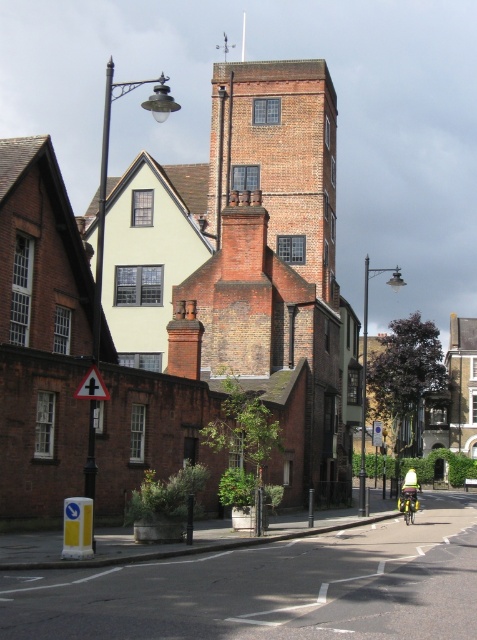
Is metallic triangular sign at center smaller than green fabric helmet at center?

Yes.

Which is behind, point (83, 385) or point (414, 499)?

Positioned behind is point (414, 499).

The width and height of the screenshot is (477, 640). Find the location of `metallic triangular sign at center`. metallic triangular sign at center is located at coordinates (92, 387).

Can you confirm if metallic triangular sign at center is wider than green matte bicycle at center?

In fact, metallic triangular sign at center might be narrower than green matte bicycle at center.

Does metallic triangular sign at center have a greater height compared to green matte bicycle at center?

No.

The height and width of the screenshot is (640, 477). Identify the location of metallic triangular sign at center. (92, 387).

This screenshot has height=640, width=477. I want to click on metallic triangular sign at center, so click(x=92, y=387).

Does metallic triangular sign at center have a greater width compared to blue plastic sign at center?

Incorrect, metallic triangular sign at center's width does not surpass blue plastic sign at center's.

Can you confirm if metallic triangular sign at center is positioned to the left of blue plastic sign at center?

Yes, metallic triangular sign at center is to the left of blue plastic sign at center.

Who is more forward, (103,397) or (376,438)?

Positioned in front is point (103,397).

Locate an element on the screen. The width and height of the screenshot is (477, 640). metallic triangular sign at center is located at coordinates [92, 387].